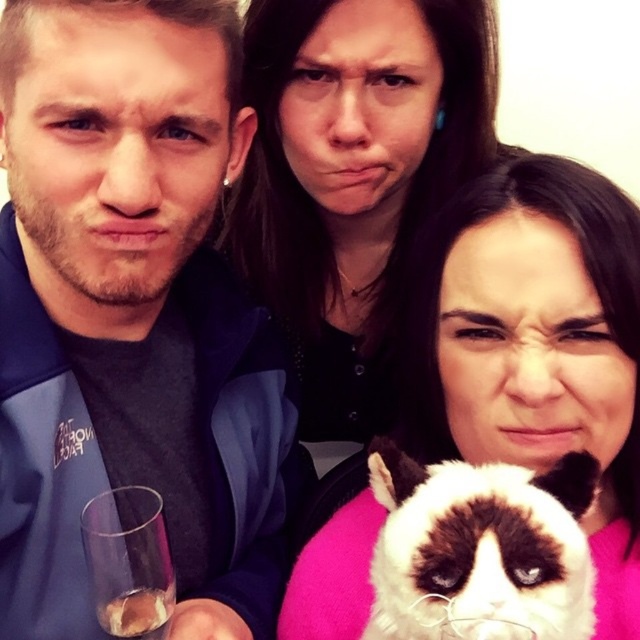
Based on the photo, is matte black cat at center to the left of transparent glass at lower left from the viewer's perspective?

No, matte black cat at center is not to the left of transparent glass at lower left.

Is point (349, 621) in front of point (154, 564)?

No, it is behind (154, 564).

The image size is (640, 640). What are the coordinates of `matte black cat at center` in the screenshot? It's located at (534, 346).

Is matte black cat at center below fluffy white cat at lower center?

No.

Between matte black cat at center and fluffy white cat at lower center, which one appears on the right side from the viewer's perspective?

matte black cat at center is more to the right.

What do you see at coordinates (534, 346) in the screenshot? The height and width of the screenshot is (640, 640). I see `matte black cat at center` at bounding box center [534, 346].

Where is `matte black cat at center`? matte black cat at center is located at coordinates (534, 346).

Can you confirm if matte blue jacket at left is taller than matte black cat at center?

Indeed, matte blue jacket at left has a greater height compared to matte black cat at center.

Can you confirm if matte blue jacket at left is positioned to the right of matte black cat at center?

No, matte blue jacket at left is not to the right of matte black cat at center.

Is point (276, 531) farther from camera compared to point (621, 440)?

Yes, point (276, 531) is behind point (621, 440).

Locate an element on the screen. Image resolution: width=640 pixels, height=640 pixels. matte blue jacket at left is located at coordinates (132, 316).